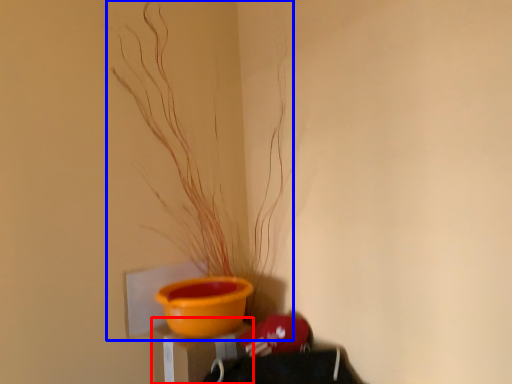
Question: Which point is further to the camera, table (highlighted by a red box) or houseplant (highlighted by a blue box)?

Choices:
 (A) table
 (B) houseplant

Answer: (A)